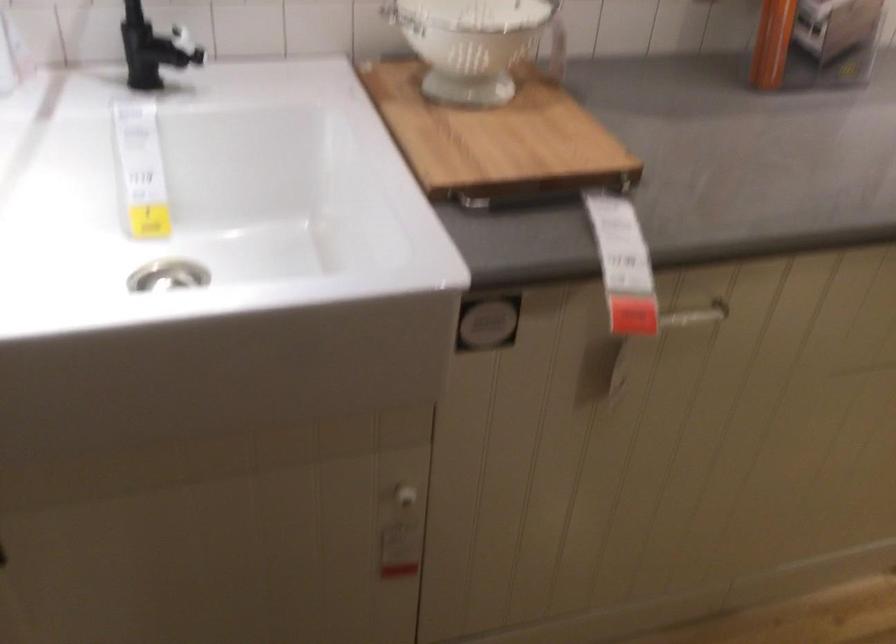
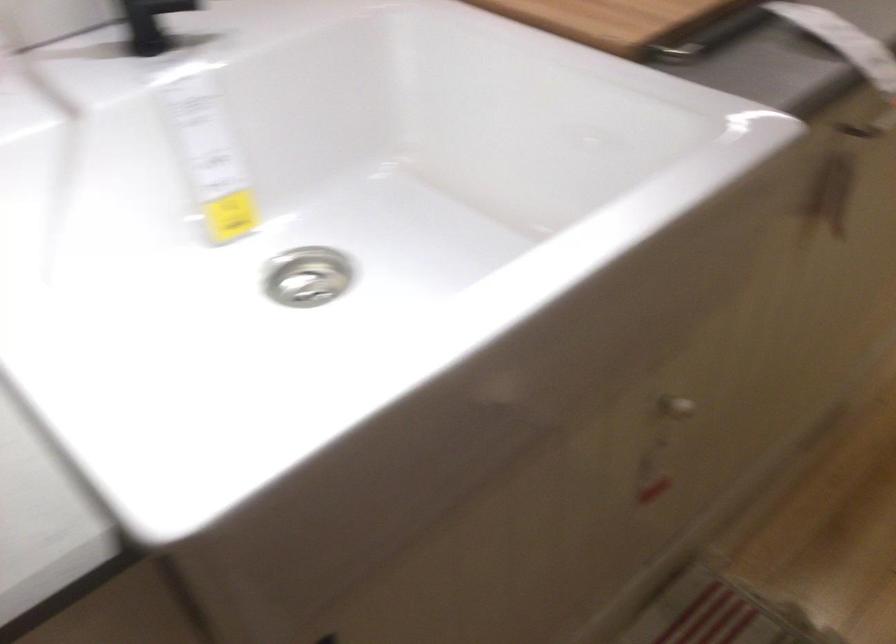
Find the pixel in the second image that matches the point at 149,71 in the first image.

(151, 23)